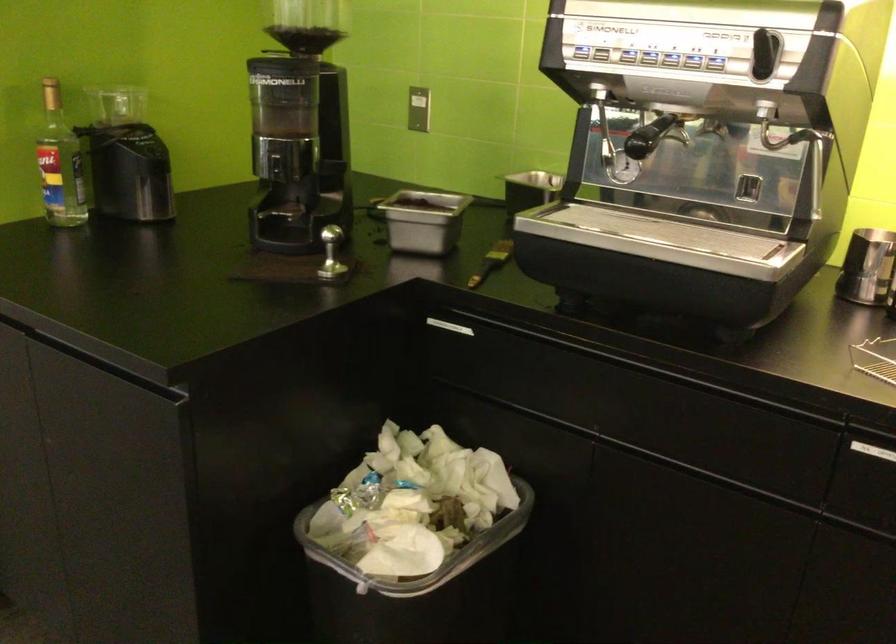
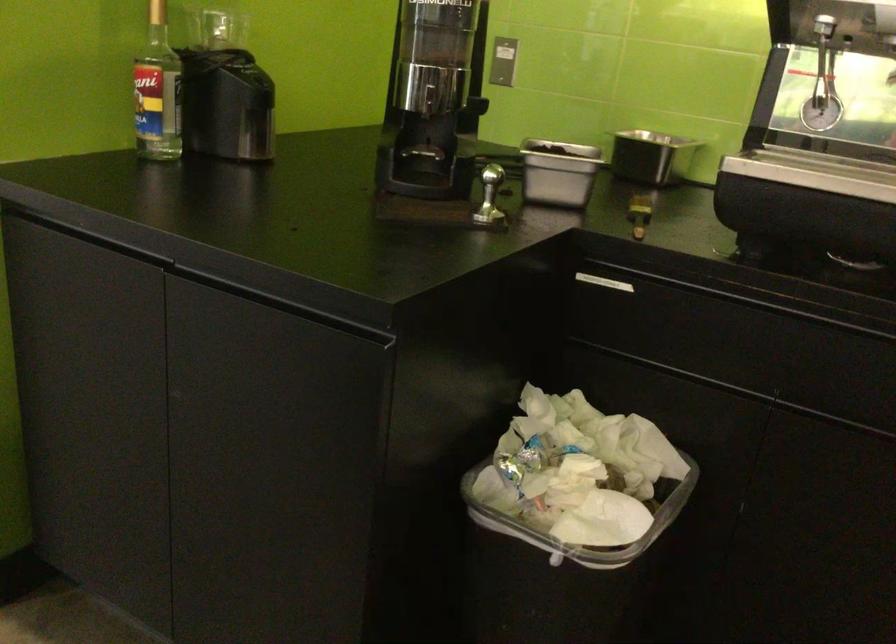
Locate, in the second image, the point that corresponds to point 113,363 in the first image.

(280, 304)